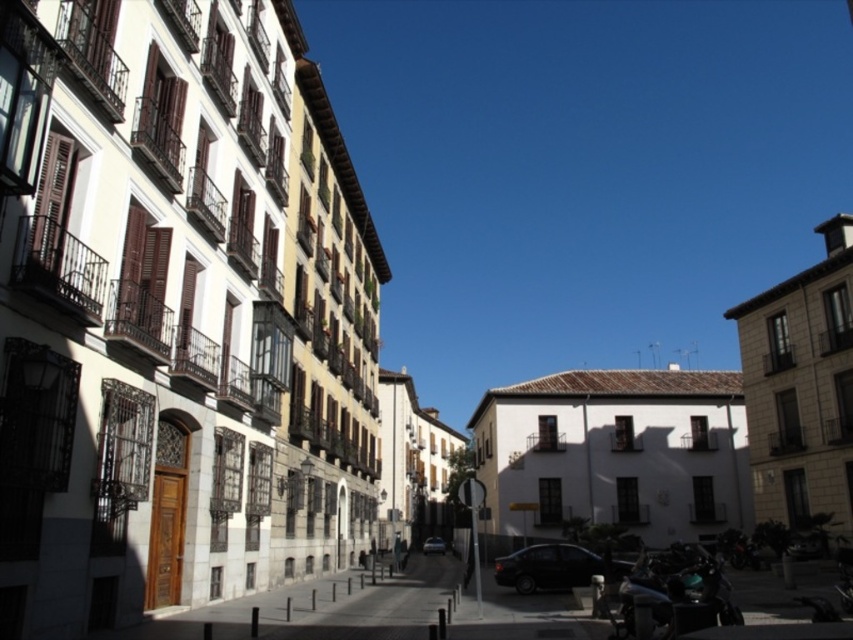
You are a delivery person who needs to park a 2.5 meters tall delivery van in the street. The van must be parked behind the shiny black sedan at center and the shiny silver car at center. Can the delivery van be parked there without hitting the overhead power lines that are 3 meters above the ground?

The shiny black sedan at center is taller than the shiny silver car at center. Since the delivery van is 2.5 meters tall and the power lines are 3 meters high, there is a 0.5 meter clearance. As the tallest vehicle would be the delivery van at 2.5 meters, it should fit under the power lines without any issues.

You are standing at the location of the viewer in this urban street scene. You want to cross the street to reach the shiny black car at center. The road is 20 meters wide. Is the distance from you to the car sufficient to safely cross the road before any potential traffic arrives?

The distance between you and the shiny black car at center is 39.50 meters. Since the road is only 20 meters wide, you have enough distance to safely cross before reaching the car, assuming no immediate traffic. However, always check for vehicles before crossing.